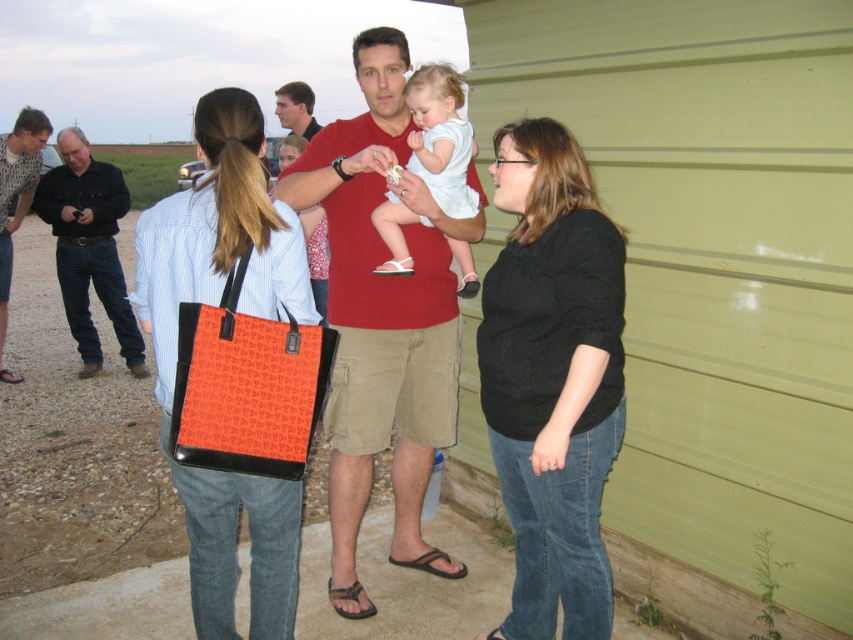
Does black cotton shirt at left appear over black flip-flop at center?

Indeed, black cotton shirt at left is positioned over black flip-flop at center.

Is black cotton shirt at left to the left of black flip-flop at center from the viewer's perspective?

Indeed, black cotton shirt at left is positioned on the left side of black flip-flop at center.

Who is more distant from viewer, (x=123, y=330) or (x=407, y=561)?

The point (x=123, y=330) is behind.

Identify the location of black cotton shirt at left. This screenshot has width=853, height=640. (90, 248).

Which is more to the left, black knit sweater at center or black flip-flop at center?

black flip-flop at center is more to the left.

You are a GUI agent. You are given a task and a screenshot of the screen. Output one action in this format:
    pyautogui.click(x=<x>, y=<y>)
    Task: Click on the black knit sweater at center
    
    Given the screenshot: What is the action you would take?
    pyautogui.click(x=552, y=378)

Does orange fabric tote bag at center have a lesser height compared to brushed metal shirt at left?

Indeed, orange fabric tote bag at center has a lesser height compared to brushed metal shirt at left.

Is orange fabric tote bag at center smaller than brushed metal shirt at left?

Yes, orange fabric tote bag at center is smaller than brushed metal shirt at left.

Does point (207, 188) lie behind point (30, 189)?

No, (207, 188) is in front of (30, 189).

Find the location of a particular element. The image size is (853, 640). orange fabric tote bag at center is located at coordinates (218, 236).